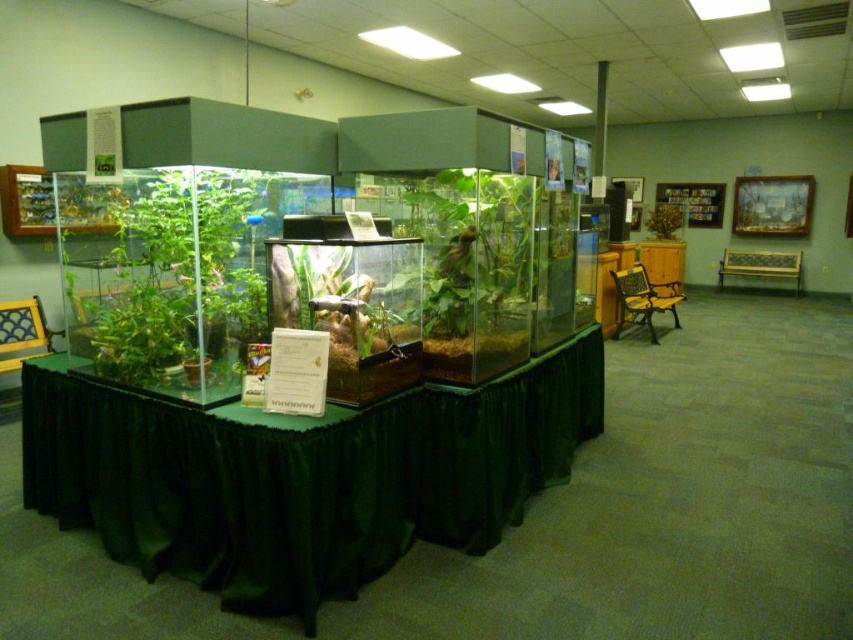
Question: Does green fabric table at center have a larger size compared to green matte plant at upper center?

Choices:
 (A) yes
 (B) no

Answer: (A)

Question: Is green fabric table at center to the right of green matte plant at center from the viewer's perspective?

Choices:
 (A) no
 (B) yes

Answer: (A)

Question: Among these points, which one is nearest to the camera?

Choices:
 (A) (508, 250)
 (B) (152, 227)
 (C) (39, 422)
 (D) (672, 209)

Answer: (B)

Question: Observing the image, what is the correct spatial positioning of green glossy plant at left in reference to green matte plant at upper center?

Choices:
 (A) left
 (B) right

Answer: (A)

Question: Among these points, which one is farthest from the camera?

Choices:
 (A) (120, 323)
 (B) (434, 273)

Answer: (B)

Question: Considering the real-world distances, which object is farthest from the green glossy plant at left?

Choices:
 (A) green matte plant at upper center
 (B) green fabric table at center
 (C) green matte plant at center

Answer: (A)